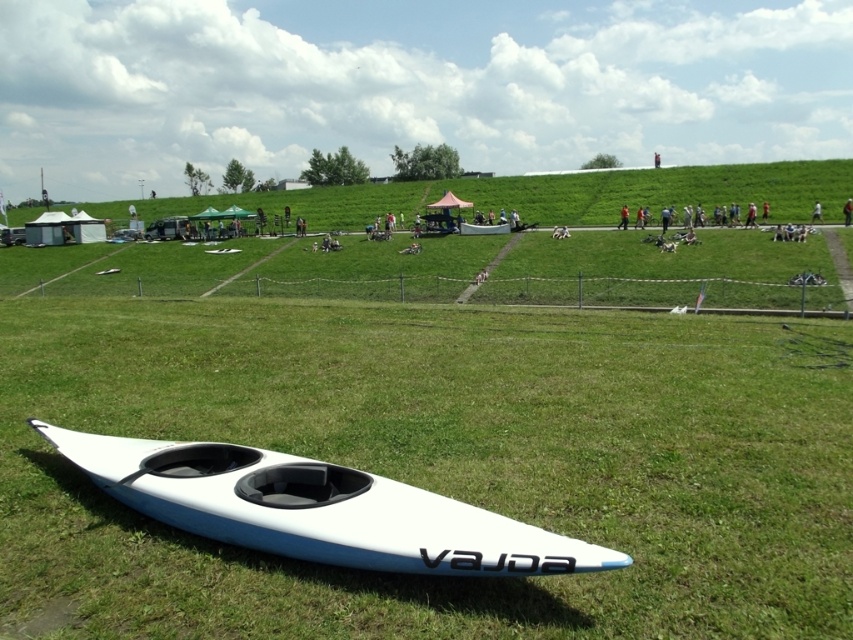
Question: Which point is farther from the camera taking this photo?

Choices:
 (A) (846, 212)
 (B) (492, 230)
 (C) (815, 205)
 (D) (229, 477)

Answer: (B)

Question: Can you confirm if green grassy hillside at upper center is positioned above dark blue fabric person at center?

Choices:
 (A) no
 (B) yes

Answer: (B)

Question: Is blue fabric jacket at center closer to the viewer compared to white matte kayak at lower left?

Choices:
 (A) yes
 (B) no

Answer: (A)

Question: Estimate the real-world distances between objects in this image. Which object is closer to the white plastic kayak at lower left?

Choices:
 (A) blue fabric jacket at center
 (B) green grassy hillside at upper center

Answer: (A)

Question: In this image, where is blue fabric jacket at center located relative to dark blue fabric person at center?

Choices:
 (A) below
 (B) above

Answer: (A)

Question: Which object is closer to the camera taking this photo?

Choices:
 (A) white plastic kayak at lower left
 (B) green grassy hillside at upper center
 (C) white matte kayak at lower left

Answer: (A)